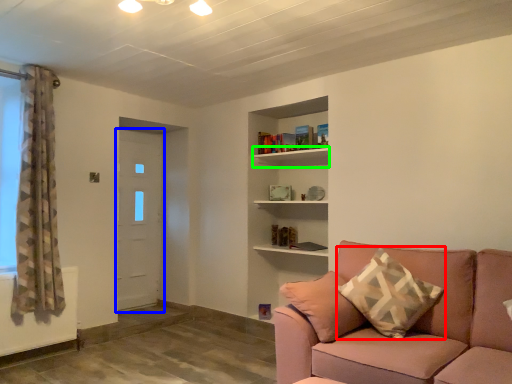
Question: Considering the real-world distances, which object is closest to pillow (highlighted by a red box)? door (highlighted by a blue box) or shelf (highlighted by a green box).

Choices:
 (A) door
 (B) shelf

Answer: (B)